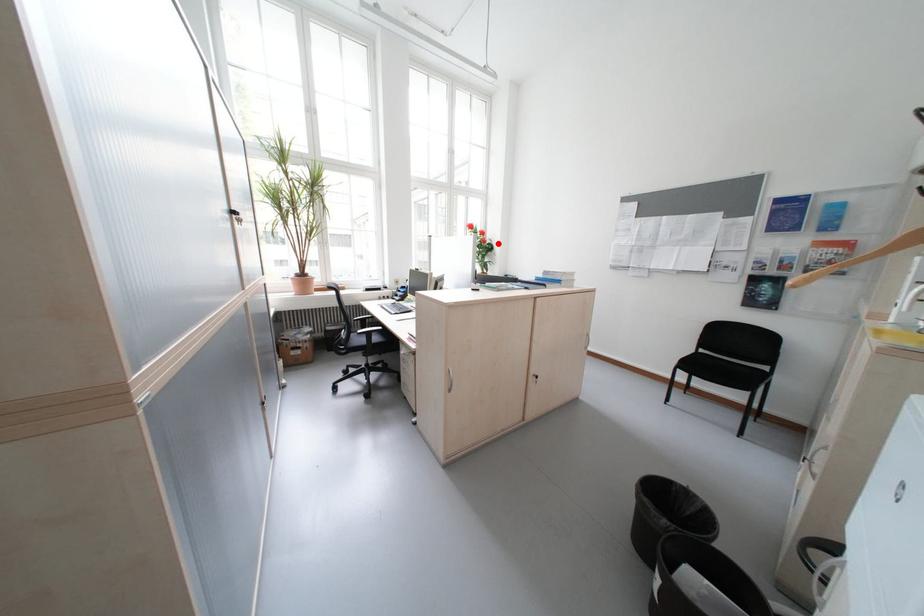
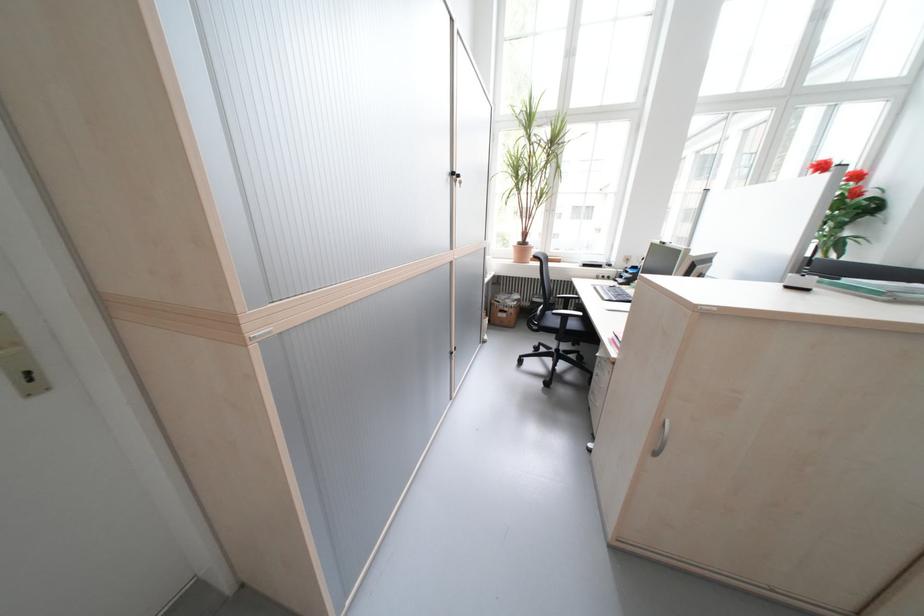
Question: I am providing you with two images of the same scene from different viewpoints. In image1, a red point is highlighted. Considering the same 3D point in image2, which of the following is correct?

Choices:
 (A) It is closer
 (B) It is farther

Answer: (B)